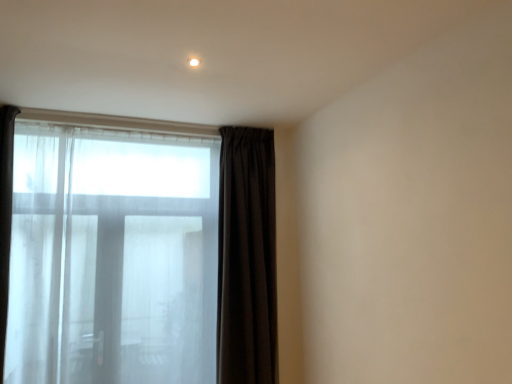
This screenshot has width=512, height=384. Describe the element at coordinates (194, 62) in the screenshot. I see `white glossy light at upper center` at that location.

Identify the location of dark matte curtain at center. (247, 258).

Looking at their sizes, would you say white glossy light at upper center is wider or thinner than dark matte curtain at center?

white glossy light at upper center is thinner than dark matte curtain at center.

How distant is white glossy light at upper center from dark matte curtain at center?

white glossy light at upper center and dark matte curtain at center are 4.64 feet apart from each other.

In terms of height, does white glossy light at upper center look taller or shorter compared to dark matte curtain at center?

Considering their sizes, white glossy light at upper center has less height than dark matte curtain at center.

Which object is closer to the camera, white glossy light at upper center or dark matte curtain at center?

white glossy light at upper center.

From the image's perspective, relative to white glossy light at upper center, is dark matte curtain at center above or below?

From the image's perspective, dark matte curtain at center appears below white glossy light at upper center.

Consider the image. Does dark matte curtain at center have a lesser width compared to white glossy light at upper center?

Incorrect, the width of dark matte curtain at center is not less than that of white glossy light at upper center.

Considering the relative sizes of dark matte curtain at center and white glossy light at upper center in the image provided, is dark matte curtain at center bigger than white glossy light at upper center?

Yes, dark matte curtain at center is bigger than white glossy light at upper center.

Is dark matte curtain at center directly adjacent to transparent fabric bay window at left?

No, dark matte curtain at center is not next to transparent fabric bay window at left.

Is point (254, 212) closer or farther from the camera than point (214, 280)?

Point (254, 212) is positioned closer to the camera compared to point (214, 280).

From a real-world perspective, is dark matte curtain at center physically located above or below transparent fabric bay window at left?

dark matte curtain at center is above transparent fabric bay window at left.

Is transparent fabric bay window at left far away from dark matte curtain at center?

Actually, transparent fabric bay window at left and dark matte curtain at center are a little close together.

Considering the sizes of objects transparent fabric bay window at left and dark matte curtain at center in the image provided, who is taller, transparent fabric bay window at left or dark matte curtain at center?

Standing taller between the two is dark matte curtain at center.

Can you confirm if transparent fabric bay window at left is smaller than dark matte curtain at center?

No, transparent fabric bay window at left is not smaller than dark matte curtain at center.

Is point (131, 345) closer or farther from the camera than point (271, 175)?

Point (131, 345) is positioned closer to the camera compared to point (271, 175).

Which is behind, point (13, 336) or point (197, 65)?

Point (13, 336)

Based on the photo, is transparent fabric bay window at left inside the boundaries of white glossy light at upper center, or outside?

transparent fabric bay window at left is located beyond the bounds of white glossy light at upper center.

Is transparent fabric bay window at left to the right of white glossy light at upper center from the viewer's perspective?

In fact, transparent fabric bay window at left is to the left of white glossy light at upper center.

Is transparent fabric bay window at left facing away from white glossy light at upper center?

No, transparent fabric bay window at left's orientation is not away from white glossy light at upper center.

Based on the photo, is white glossy light at upper center smaller than transparent fabric bay window at left?

Yes, white glossy light at upper center is smaller than transparent fabric bay window at left.

Between white glossy light at upper center and transparent fabric bay window at left, which one has smaller width?

white glossy light at upper center.

Can you tell me how much white glossy light at upper center and transparent fabric bay window at left differ in facing direction?

89.5 degrees.

Which object is positioned more to the left, white glossy light at upper center or transparent fabric bay window at left?

From the viewer's perspective, transparent fabric bay window at left appears more on the left side.

Where is `light above the dark matte curtain at center (from the image's perspective)`? light above the dark matte curtain at center (from the image's perspective) is located at coordinates (194, 62).

The height and width of the screenshot is (384, 512). I want to click on curtain behind the white glossy light at upper center, so click(x=247, y=258).

From the image, which object appears to be farther from dark matte curtain at center, transparent fabric bay window at left or white glossy light at upper center?

The object further to dark matte curtain at center is white glossy light at upper center.

Looking at the image, which one is located closer to white glossy light at upper center, dark matte curtain at center or transparent fabric bay window at left?

dark matte curtain at center.

Estimate the real-world distances between objects in this image. Which object is further from white glossy light at upper center, transparent fabric bay window at left or dark matte curtain at center?

The object further to white glossy light at upper center is transparent fabric bay window at left.

From the image, which object appears to be nearer to transparent fabric bay window at left, white glossy light at upper center or dark matte curtain at center?

dark matte curtain at center is closer to transparent fabric bay window at left.

Based on their spatial positions, is white glossy light at upper center or transparent fabric bay window at left further from dark matte curtain at center?

white glossy light at upper center lies further to dark matte curtain at center than the other object.

Looking at the image, which one is located closer to transparent fabric bay window at left, dark matte curtain at center or white glossy light at upper center?

Based on the image, dark matte curtain at center appears to be nearer to transparent fabric bay window at left.

I want to click on curtain that lies between white glossy light at upper center and transparent fabric bay window at left from top to bottom, so click(x=247, y=258).